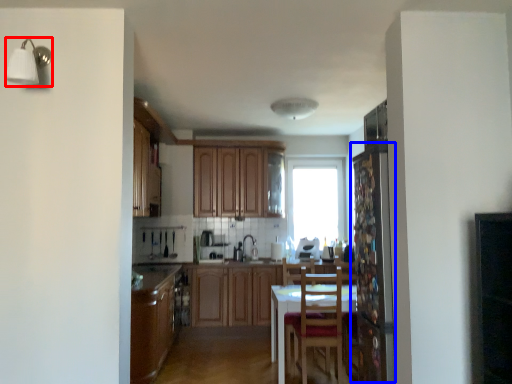
Question: Which object is closer to the camera taking this photo, light fixture (highlighted by a red box) or screen door (highlighted by a blue box)?

Choices:
 (A) light fixture
 (B) screen door

Answer: (A)